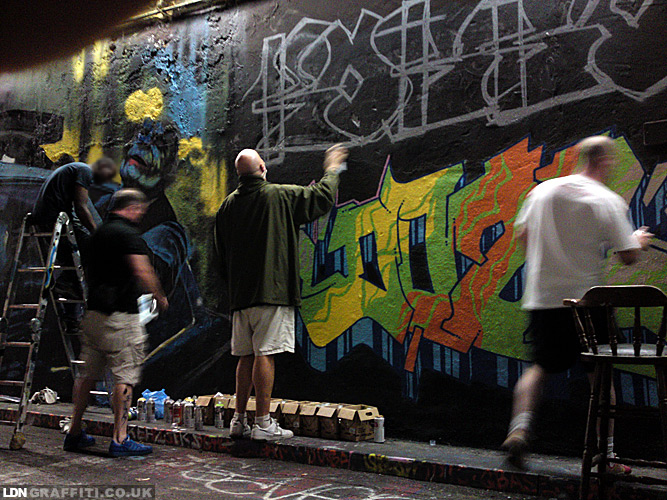
Where is `wall`? wall is located at coordinates (247, 52).